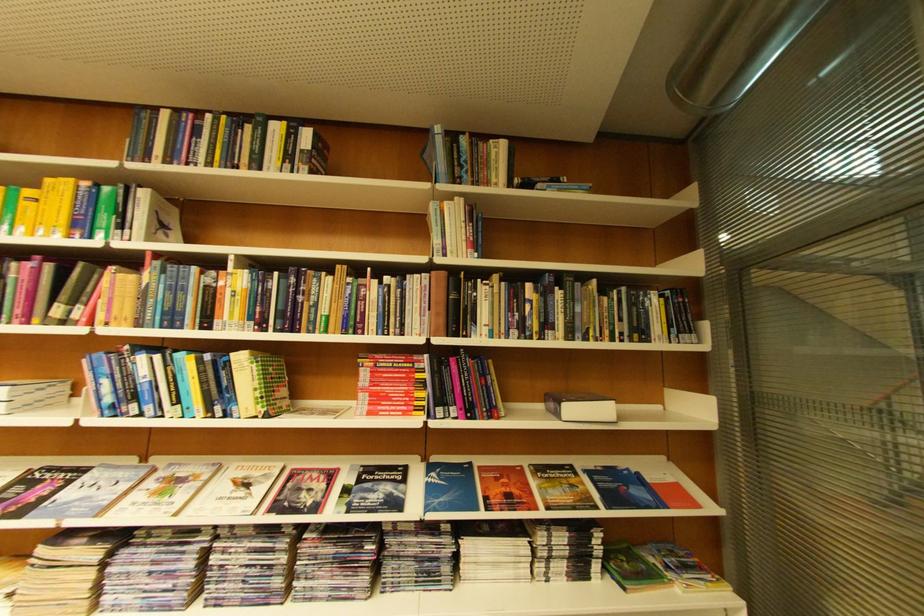
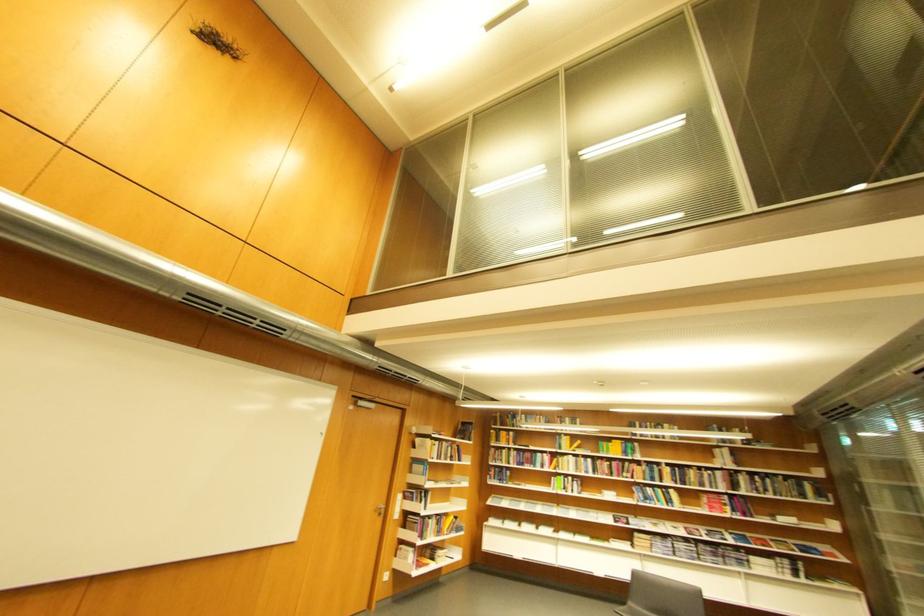
Find the pixel in the second image that matches (179,576) in the first image.

(677, 549)